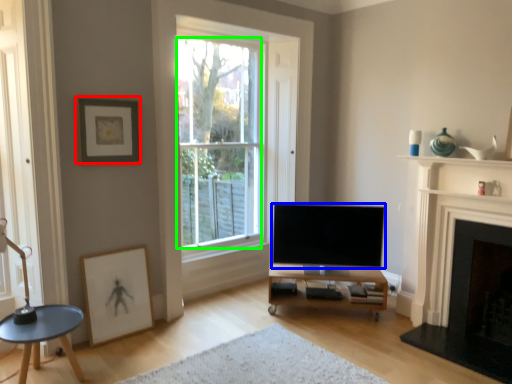
Question: Which object is the farthest from picture frame (highlighted by a red box)? Choose among these: television (highlighted by a blue box) or window (highlighted by a green box).

Choices:
 (A) television
 (B) window

Answer: (B)